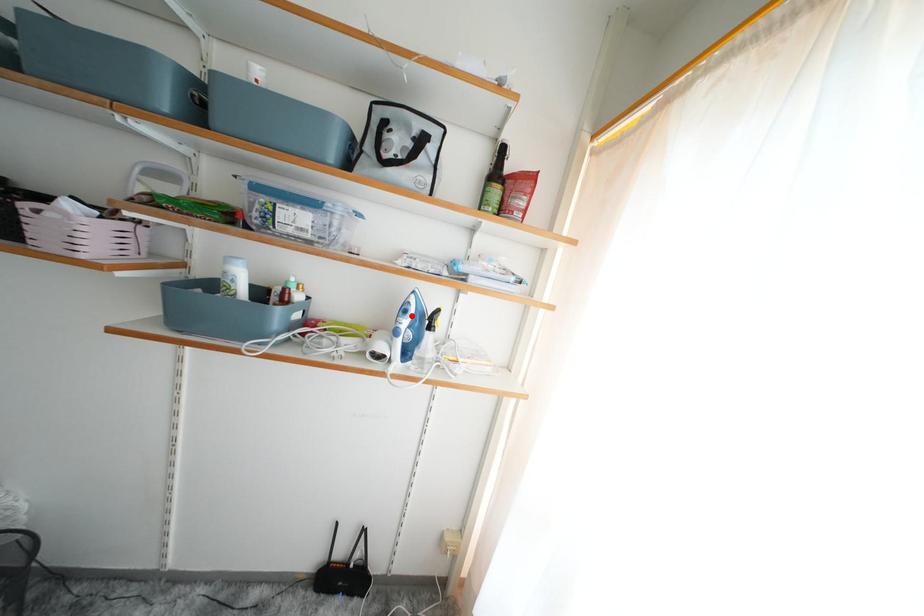
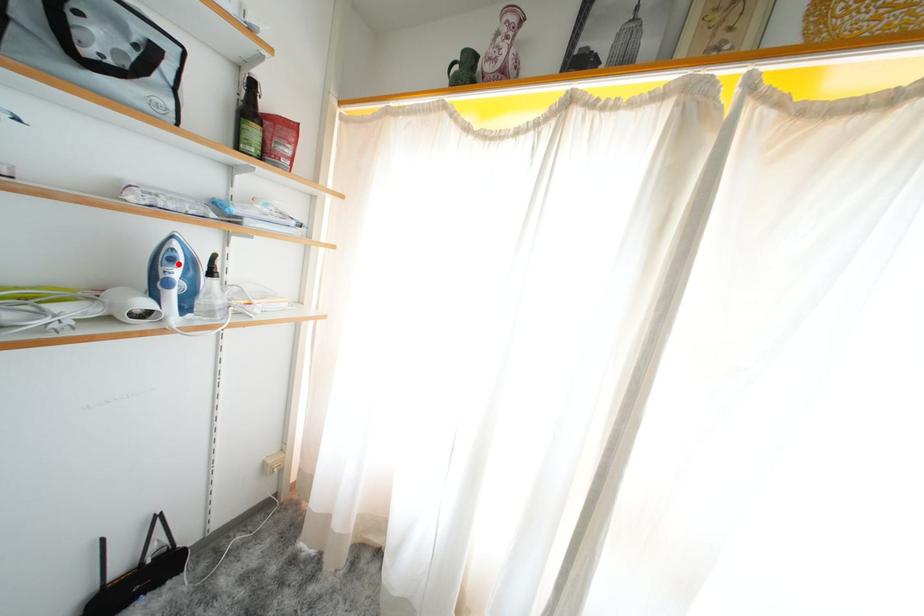
I am providing you with two images of the same scene from different viewpoints. A red point is marked on the first image and another point is marked on the second image. Do the highlighted points in image1 and image2 indicate the same real-world spot?

Yes